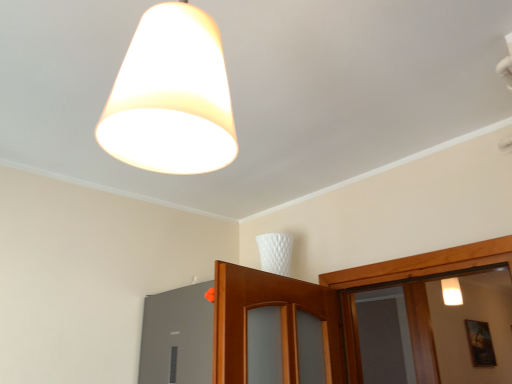
Question: In the image, is wooden framed picture at lower right on the left side or the right side of matte gray window at lower left?

Choices:
 (A) left
 (B) right

Answer: (B)

Question: Considering the positions of wooden framed picture at lower right and matte gray window at lower left in the image, is wooden framed picture at lower right wider or thinner than matte gray window at lower left?

Choices:
 (A) thin
 (B) wide

Answer: (B)

Question: Which is farther from the matte gray window at lower left?

Choices:
 (A) wooden framed picture at lower right
 (B) white matte lampshade at upper center

Answer: (A)

Question: Considering the real-world distances, which object is farthest from the matte gray window at lower left?

Choices:
 (A) white matte lampshade at upper center
 (B) wooden framed picture at lower right

Answer: (B)